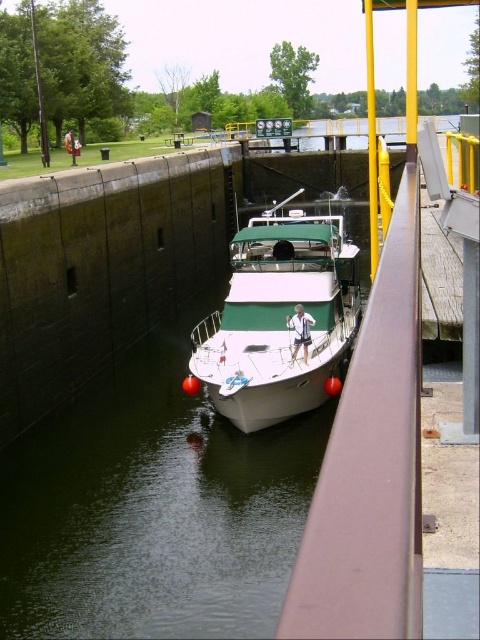
You are a sailor trying to dock your boat in the lock. You notice the white glossy water at center and the white glossy boat at center. Which object takes up more space in the scene?

The white glossy boat at center occupies more space than the white glossy water at center.

You are a sailor on the white glossy boat at center. You notice the white glossy water at center. Which side of the boat is the water located?

The white glossy water at center is positioned on the left side of the white glossy boat at center, so the water is to the left side of the boat.